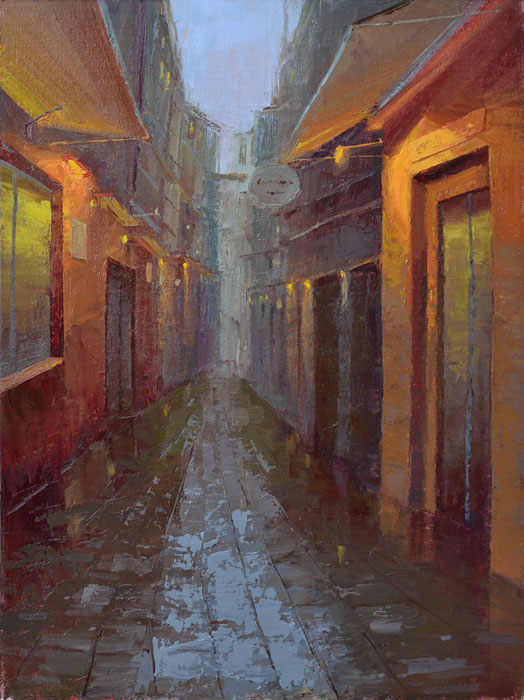
Where is `right side door`? This screenshot has width=524, height=700. right side door is located at coordinates (442, 365), (376, 355), (339, 358).